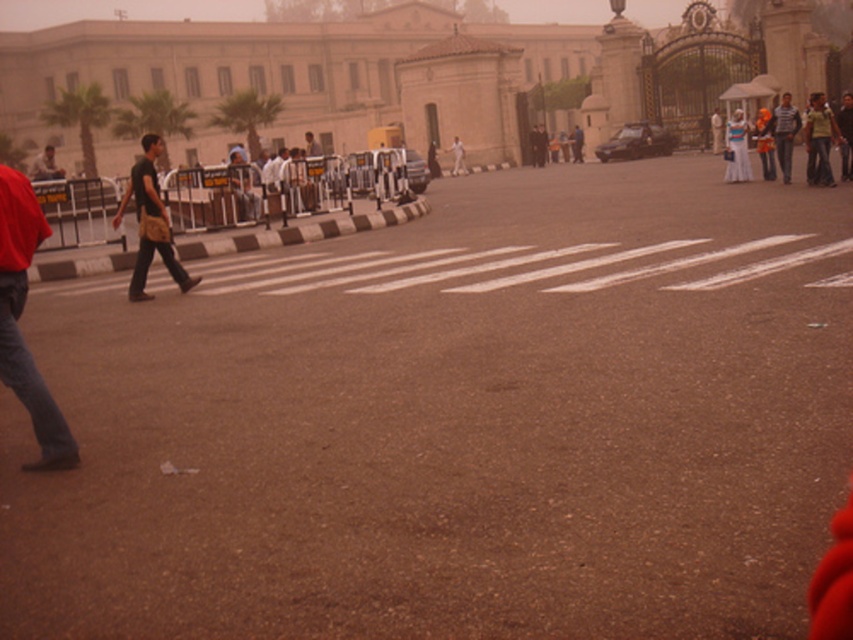
Is point (1, 218) behind point (810, 140)?

No, (1, 218) is in front of (810, 140).

Is point (74, 465) farther from camera compared to point (817, 172)?

No, (74, 465) is in front of (817, 172).

Find the location of `denim jeans at left`. denim jeans at left is located at coordinates 19,316.

Does striped shirt at center have a lesser height compared to orange fabric bag at center-right?

No, striped shirt at center is not shorter than orange fabric bag at center-right.

Who is positioned more to the right, striped shirt at center or orange fabric bag at center-right?

striped shirt at center is more to the right.

Which is behind, point (785, 156) or point (761, 128)?

The point (761, 128) is behind.

This screenshot has height=640, width=853. In order to click on striped shirt at center in this screenshot , I will do `click(784, 132)`.

Locate an element on the screen. denim jeans at left is located at coordinates (19, 316).

Does denim jeans at left have a greater width compared to light brown leather jacket at center?

No, denim jeans at left is not wider than light brown leather jacket at center.

Locate an element on the screen. denim jeans at left is located at coordinates (19, 316).